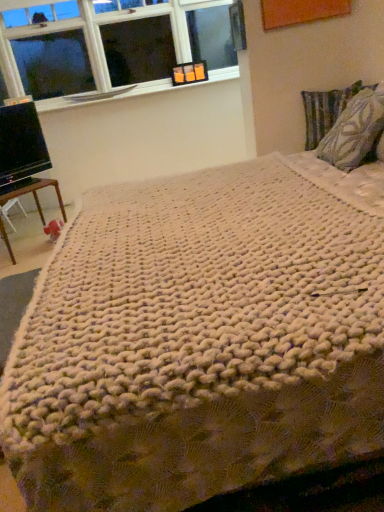
What do you see at coordinates (131, 91) in the screenshot? I see `white textured window sill at upper left` at bounding box center [131, 91].

Identify the location of brown wooden table at lower left. (32, 193).

Is brown wooden table at lower left turned away from textured fabric pillow at upper right, arranged as the 1th pillow when viewed from the back?

No, brown wooden table at lower left's orientation is not away from textured fabric pillow at upper right, arranged as the 1th pillow when viewed from the back.

Can textured fabric pillow at upper right, placed as the 2th pillow when sorted from front to back, be found inside brown wooden table at lower left?

No.

Between point (6, 243) and point (333, 105), which one is positioned in front?

The point (333, 105) is more forward.

Between brown wooden table at lower left and patterned fabric pillow at right, the first pillow when ordered from front to back, which one is positioned behind?

brown wooden table at lower left is further away from the camera.

Would you say brown wooden table at lower left is outside patterned fabric pillow at right, which is the 2th pillow from back to front?

brown wooden table at lower left is positioned outside patterned fabric pillow at right, which is the 2th pillow from back to front.

Based on the photo, is brown wooden table at lower left oriented towards patterned fabric pillow at right, the first pillow when ordered from front to back?

No, brown wooden table at lower left is not aimed at patterned fabric pillow at right, the first pillow when ordered from front to back.

Is orange plastic picture frame at upper center looking in the opposite direction of patterned fabric pillow at right, which is the 2th pillow from back to front?

No, orange plastic picture frame at upper center's orientation is not away from patterned fabric pillow at right, which is the 2th pillow from back to front.

Is the position of orange plastic picture frame at upper center less distant than that of patterned fabric pillow at right, the first pillow when ordered from front to back?

No.

Considering the relative sizes of patterned fabric pillow at right, which is the 2th pillow from back to front, and brown wooden table at lower left in the image provided, is patterned fabric pillow at right, which is the 2th pillow from back to front, wider than brown wooden table at lower left?

Incorrect, the width of patterned fabric pillow at right, which is the 2th pillow from back to front, does not surpass that of brown wooden table at lower left.

Is patterned fabric pillow at right, the first pillow when ordered from front to back, oriented towards brown wooden table at lower left?

No, patterned fabric pillow at right, the first pillow when ordered from front to back, is not aimed at brown wooden table at lower left.

Between patterned fabric pillow at right, which is the 2th pillow from back to front, and brown wooden table at lower left, which one appears on the left side from the viewer's perspective?

From the viewer's perspective, brown wooden table at lower left appears more on the left side.

Is black glossy monitor at left facing away from brown wooden table at lower left?

No, black glossy monitor at left's orientation is not away from brown wooden table at lower left.

Which is in front, black glossy monitor at left or brown wooden table at lower left?

black glossy monitor at left is closer to the camera.

Is black glossy monitor at left to the left of brown wooden table at lower left from the viewer's perspective?

Yes.

This screenshot has width=384, height=512. I want to click on computer monitor on the left of brown wooden table at lower left, so click(21, 143).

Is textured fabric pillow at upper right, arranged as the 1th pillow when viewed from the back, facing away from black glossy monitor at left?

No.

Identify the location of computer monitor located on the left of textured fabric pillow at upper right, arranged as the 1th pillow when viewed from the back. (21, 143).

Which object is positioned more to the left, textured fabric pillow at upper right, arranged as the 1th pillow when viewed from the back, or black glossy monitor at left?

From the viewer's perspective, black glossy monitor at left appears more on the left side.

Are textured fabric pillow at upper right, arranged as the 1th pillow when viewed from the back, and black glossy monitor at left making contact?

They are not placed beside each other.

Does black glossy monitor at left appear on the left side of white textured window sill at upper left?

Indeed, black glossy monitor at left is positioned on the left side of white textured window sill at upper left.

Is black glossy monitor at left oriented away from white textured window sill at upper left?

black glossy monitor at left is not turned away from white textured window sill at upper left.

From a real-world perspective, who is located lower, black glossy monitor at left or white textured window sill at upper left?

black glossy monitor at left.

Who is shorter, black glossy monitor at left or white textured window sill at upper left?

With less height is white textured window sill at upper left.

Locate an element on the screen. The height and width of the screenshot is (512, 384). table below the textured fabric pillow at upper right, arranged as the 1th pillow when viewed from the back (from the image's perspective) is located at coordinates (32, 193).

Image resolution: width=384 pixels, height=512 pixels. Find the location of `the 2nd pillow located above the brown wooden table at lower left (from a real-world perspective)`. the 2nd pillow located above the brown wooden table at lower left (from a real-world perspective) is located at coordinates (354, 130).

Considering their positions, is white textured window sill at upper left positioned further to black glossy monitor at left than clear glass window at upper left?

Among the two, clear glass window at upper left is located further to black glossy monitor at left.

From the image, which object appears to be farther from black glossy monitor at left, clear glass window at upper left or white textured window sill at upper left?

clear glass window at upper left is positioned further to the anchor black glossy monitor at left.

From the image, which object appears to be nearer to patterned fabric pillow at right, which is the 2th pillow from back to front, brown wooden table at lower left or orange plastic picture frame at upper center?

brown wooden table at lower left lies closer to patterned fabric pillow at right, which is the 2th pillow from back to front, than the other object.

From the image, which object appears to be farther from clear glass window at upper left, white textured window sill at upper left or brown wooden table at lower left?

brown wooden table at lower left is positioned further to the anchor clear glass window at upper left.

Considering their positions, is textured fabric pillow at upper right, arranged as the 1th pillow when viewed from the back, positioned further to clear glass window at upper left than brown wooden table at lower left?

Among the two, textured fabric pillow at upper right, arranged as the 1th pillow when viewed from the back, is located further to clear glass window at upper left.

Looking at the image, which one is located closer to brown wooden table at lower left, white textured window sill at upper left or clear glass window at upper left?

Based on the image, white textured window sill at upper left appears to be nearer to brown wooden table at lower left.

Looking at the image, which one is located further to textured fabric pillow at upper right, arranged as the 1th pillow when viewed from the back, brown wooden table at lower left or clear glass window at upper left?

Among the two, brown wooden table at lower left is located further to textured fabric pillow at upper right, arranged as the 1th pillow when viewed from the back.

Looking at the image, which one is located closer to white textured window sill at upper left, patterned fabric pillow at right, which is the 2th pillow from back to front, or black glossy monitor at left?

Among the two, black glossy monitor at left is located nearer to white textured window sill at upper left.

Image resolution: width=384 pixels, height=512 pixels. I want to click on picture frame between brown wooden table at lower left and textured fabric pillow at upper right, placed as the 2th pillow when sorted from front to back, in the horizontal direction, so click(x=189, y=73).

The height and width of the screenshot is (512, 384). I want to click on window sill situated between clear glass window at upper left and orange plastic picture frame at upper center from left to right, so click(131, 91).

Where is `window sill between clear glass window at upper left and patterned fabric pillow at right, which is the 2th pillow from back to front`? window sill between clear glass window at upper left and patterned fabric pillow at right, which is the 2th pillow from back to front is located at coordinates coord(131,91).

In order to click on pillow between clear glass window at upper left and patterned fabric pillow at right, the first pillow when ordered from front to back, in the horizontal direction in this screenshot , I will do `click(324, 111)`.